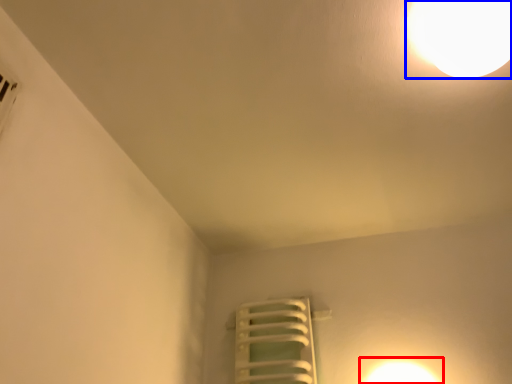
Question: Which point is further to the camera, light (highlighted by a red box) or lamp (highlighted by a blue box)?

Choices:
 (A) light
 (B) lamp

Answer: (A)